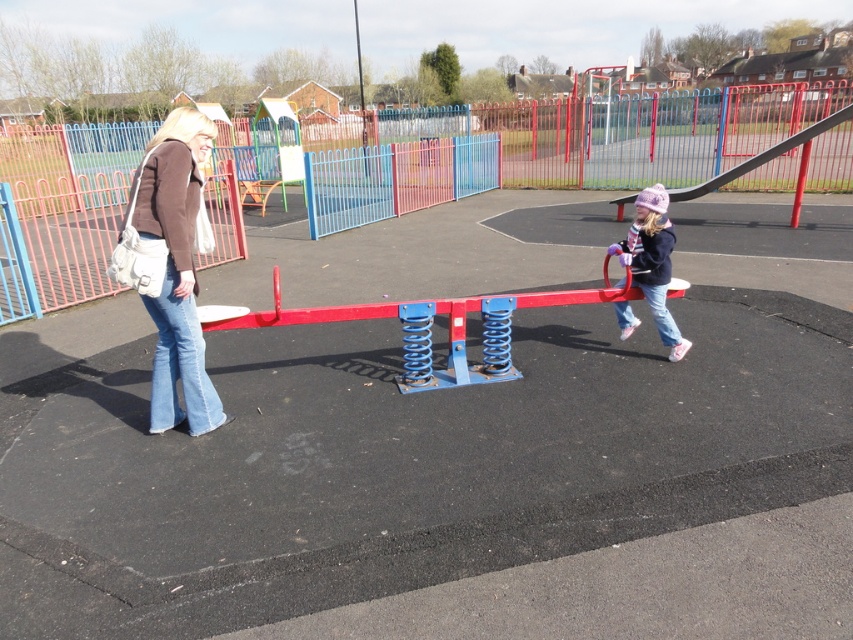
You are a parent at the playground. You see the matte purple hat at center and the metallic gray slide at right. Which object is closer to the ground?

The matte purple hat at center is closer to the ground because it is located below the metallic gray slide at right.

You are a parent at the playground. You want to ensure your child can reach both the denim jeans at left and the metallic gray slide at right. Based on their heights, which one is taller?

The denim jeans at left is taller than the metallic gray slide at right, so the child can reach the denim jeans at left more easily than the metallic gray slide at right.

Where is the denim jeans at left located in the image?

The denim jeans at left is located at point (171, 268).